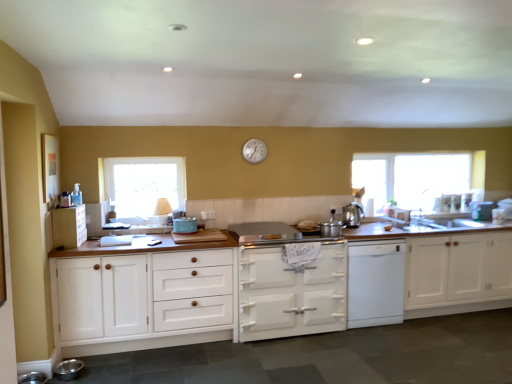
Identify the location of vacant space in front of polished stainless steel kettle at center right, marked as the second appliance in a back-to-front arrangement. This screenshot has height=384, width=512. (355, 235).